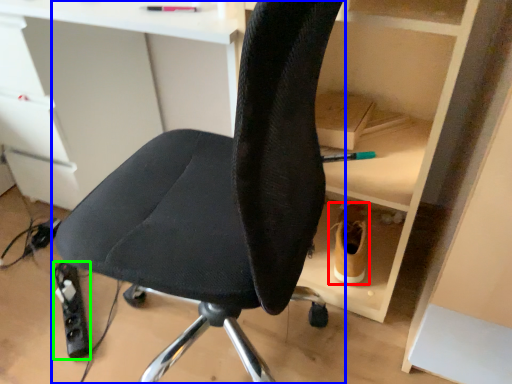
Question: Which object is the closest to the footwear (highlighted by a red box)? Choose among these: chair (highlighted by a blue box) or equipment (highlighted by a green box).

Choices:
 (A) chair
 (B) equipment

Answer: (A)